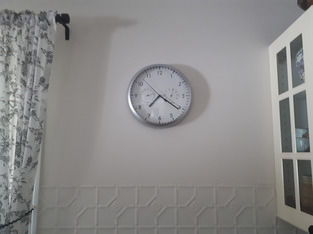
Locate an element on the screen. This screenshot has height=234, width=313. glass on the cabinet is located at coordinates (288, 168), (299, 169), (297, 114), (287, 112), (281, 78), (295, 72).